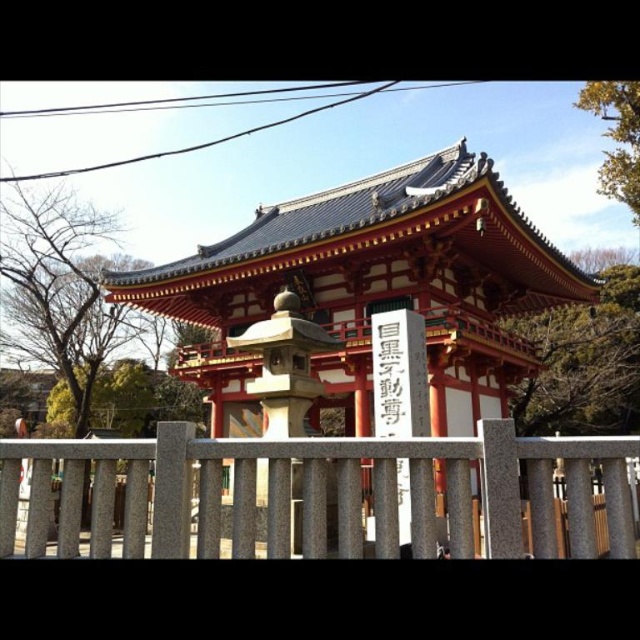
Which is more to the right, gray stone fence at center or black stone sign at center?

Positioned to the right is black stone sign at center.

Who is more distant from viewer, (550, 492) or (400, 340)?

The point (400, 340) is behind.

This screenshot has height=640, width=640. I want to click on gray stone fence at center, so click(317, 492).